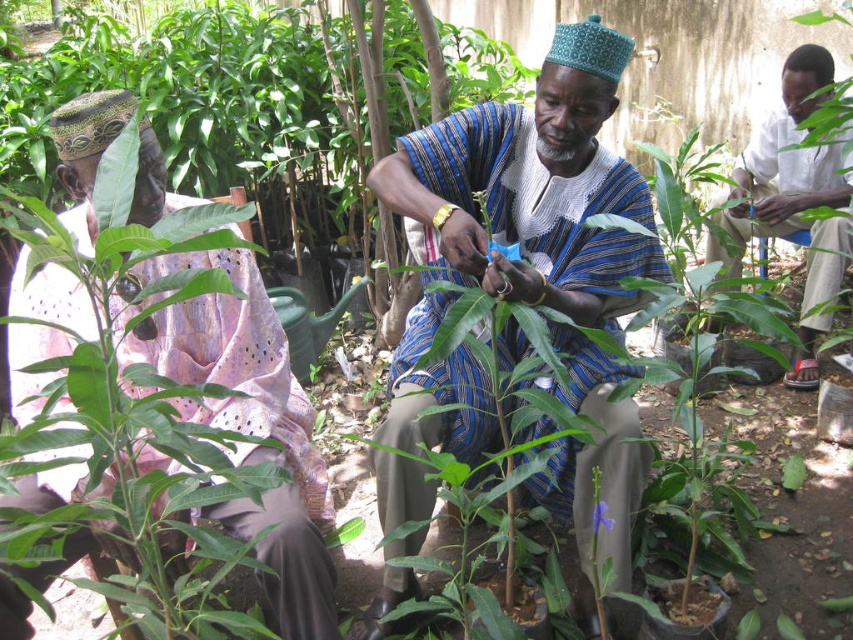
Is matte pink fabric at left positioned in front of white cotton shirt at upper right?

That is True.

Does matte pink fabric at left appear under white cotton shirt at upper right?

Yes, matte pink fabric at left is below white cotton shirt at upper right.

This screenshot has width=853, height=640. In order to click on matte pink fabric at left in this screenshot , I will do `click(247, 422)`.

Does blue striped cloth at center have a smaller size compared to matte pink fabric at left?

Yes.

Measure the distance between blue striped cloth at center and camera.

A distance of 1.54 meters exists between blue striped cloth at center and camera.

Find the location of `blue striped cloth at center`. blue striped cloth at center is located at coordinates (534, 188).

The width and height of the screenshot is (853, 640). I want to click on blue striped cloth at center, so click(534, 188).

Is blue striped cloth at center taller than white cotton shirt at upper right?

Indeed, blue striped cloth at center has a greater height compared to white cotton shirt at upper right.

Is point (543, 161) positioned in front of point (799, 173)?

Yes, it is in front of point (799, 173).

Identify the location of blue striped cloth at center. (534, 188).